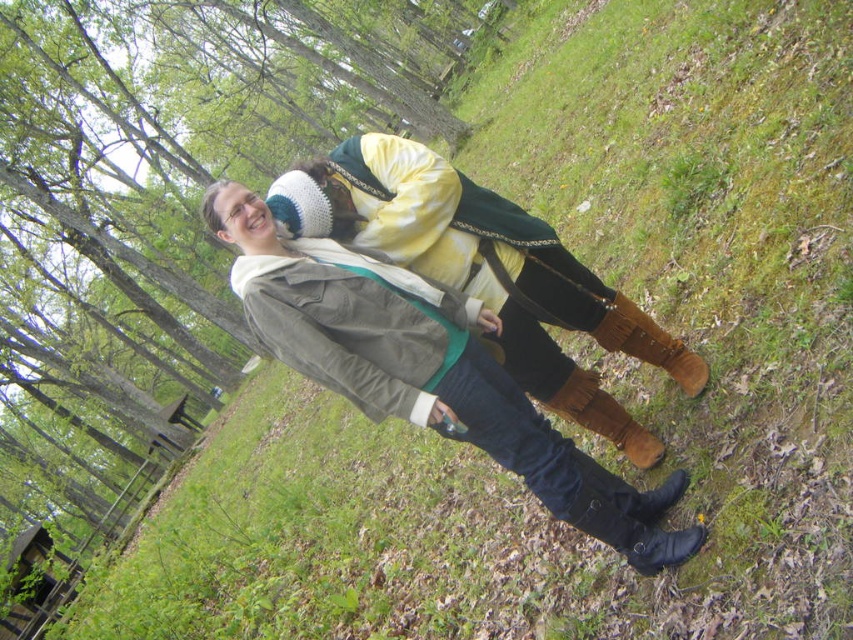
Is the position of brown suede boot at lower center more distant than that of brown suede boot at lower right?

No, it is in front of brown suede boot at lower right.

Identify the location of brown suede boot at lower center. This screenshot has width=853, height=640. (648, 342).

The height and width of the screenshot is (640, 853). Identify the location of brown suede boot at lower center. (648, 342).

Is matte brown boots at center bigger than brown suede boot at lower center?

Correct, matte brown boots at center is larger in size than brown suede boot at lower center.

Which is more to the right, matte brown boots at center or brown suede boot at lower center?

Positioned to the right is brown suede boot at lower center.

Describe the element at coordinates (427, 372) in the screenshot. The width and height of the screenshot is (853, 640). I see `matte brown boots at center` at that location.

What are the coordinates of `matte brown boots at center` in the screenshot? It's located at (427, 372).

Which is in front, point (572, 502) or point (579, 381)?

Point (572, 502) is in front.

Which is above, matte brown boots at center or brown suede boot at lower right?

matte brown boots at center is higher up.

You are a GUI agent. You are given a task and a screenshot of the screen. Output one action in this format:
    pyautogui.click(x=<x>, y=<y>)
    Task: Click on the matte brown boots at center
    
    Given the screenshot: What is the action you would take?
    pyautogui.click(x=427, y=372)

Image resolution: width=853 pixels, height=640 pixels. Find the location of `matte brown boots at center`. matte brown boots at center is located at coordinates (427, 372).